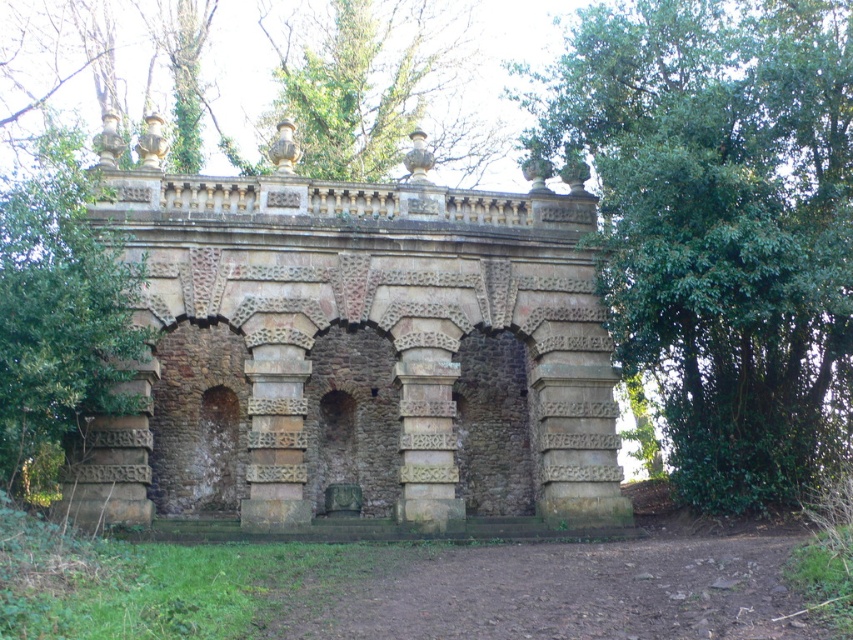
You are standing in front of the ancient stone structure. There is a green leafy tree at upper right. Where is the point located at coordinates (718, 221)?

The point at coordinates (718, 221) corresponds to the green leafy tree at upper right.

You are an architect visiting the ancient stone structure. You notice the brown stone arches at center and the green leafy tree at upper center. Which object occupies more space in the image?

The brown stone arches at center is bigger than the green leafy tree at upper center, so the brown stone arches at center occupies more space in the image.